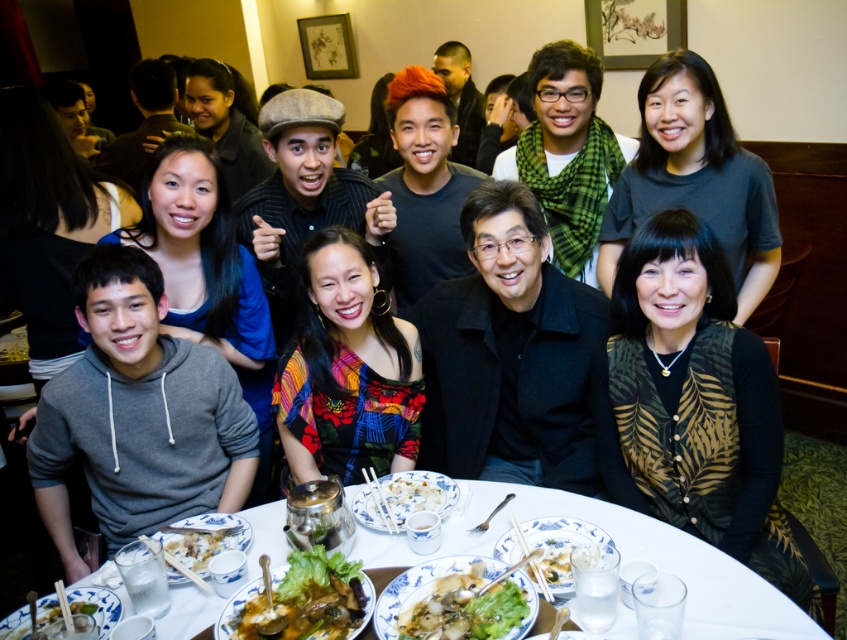
From the picture: You are a food photographer and want to capture the green leafy vegetable at center and the white porcelain plate at center in a way that highlights their height difference. Which object should you position closer to the camera to emphasize this contrast?

To emphasize the height difference between the green leafy vegetable at center and the white porcelain plate at center, position the green leafy vegetable at center closer to the camera since it is taller than the white porcelain plate at center.

You are a photographer standing at the origin point of the coordinate system. You want to take a photo of the white porcelain table at center. What are the coordinates of the table?

The coordinates of the white porcelain table at center are at point (621, 557).

You are taking a photo of the dining area and want to ensure the white porcelain table at center is centered in the frame. Given its current 2D coordinates, what adjustments should you make to the camera position?

The white porcelain table at center is located at coordinates 0.872 on the x and 0.734 on the y axis. To center it, adjust the camera so the table moves to the center point of the frame, which is typically at coordinates like (x=423, y=320). This would require moving the camera left and down slightly.